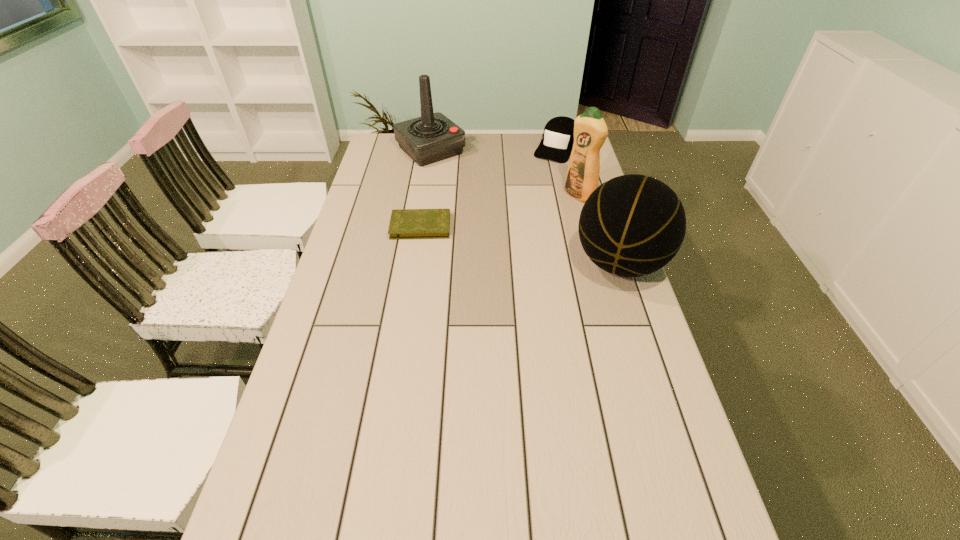
Where is `diary`? diary is located at coordinates (405, 223).

I want to click on basketball, so click(632, 225).

This screenshot has height=540, width=960. Identify the location of the second shortest object. (558, 137).

Identify the location of detergent. The width and height of the screenshot is (960, 540). coord(590,130).

Identify the location of joystick. (433, 137).

Where is `vacant space located 0.100m on the right of the diary`? The width and height of the screenshot is (960, 540). vacant space located 0.100m on the right of the diary is located at coordinates (480, 226).

The width and height of the screenshot is (960, 540). Find the location of `free location located on the back of the basketball`. free location located on the back of the basketball is located at coordinates (592, 179).

Identify the location of blank space located 0.180m on the front-facing side of the cap. Image resolution: width=960 pixels, height=540 pixels. (534, 185).

You are a GUI agent. You are given a task and a screenshot of the screen. Output one action in this format:
    pyautogui.click(x=<x>, y=<y>)
    Task: Click on the vacant region located on the front-facing side of the cap
    
    Given the screenshot: What is the action you would take?
    pyautogui.click(x=544, y=170)

Locate an element on the screen. free space located 0.220m on the front-facing side of the cap is located at coordinates (530, 190).